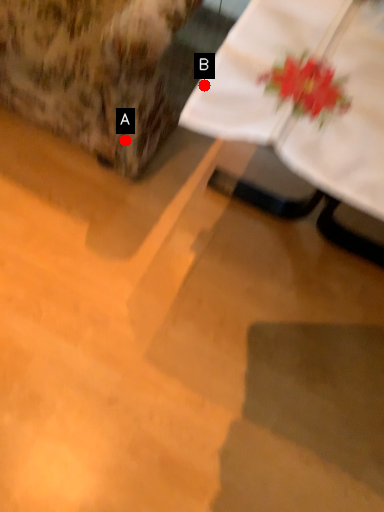
Question: Two points are circled on the image, labeled by A and B beside each circle. Which point is farther to the camera?

Choices:
 (A) A is further
 (B) B is further

Answer: (A)